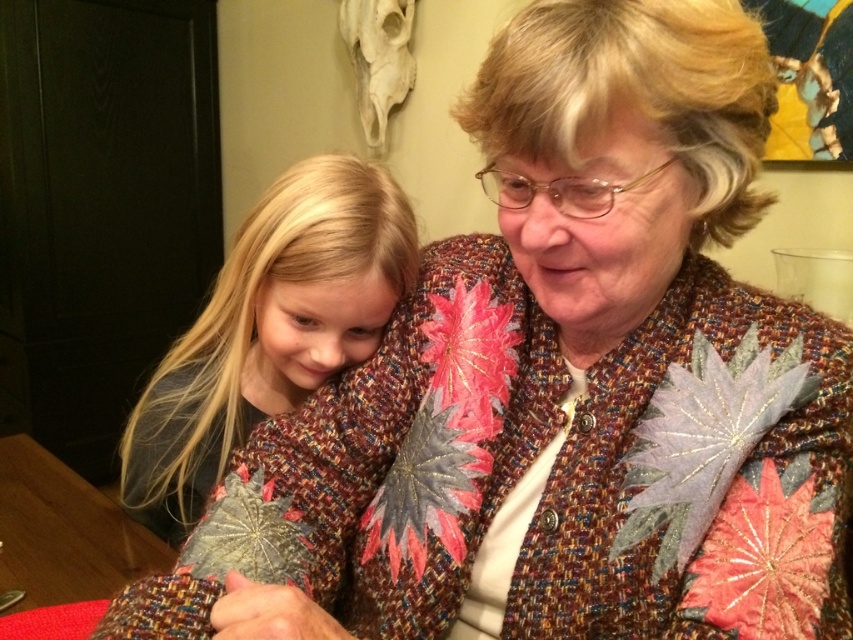
You are standing in the room and want to know which of the two points, point (398, 218) or point (55, 600), is closer to you. Can you determine this based on the scene?

Point (398, 218) is closer to the camera than point (55, 600), so it is closer to you.

You are a photographer trying to capture a candid shot of the grandmother and granddaughter. You notice the blonde hair at left and the wooden table at lower left. Which object is taller from your perspective?

The blonde hair at left is taller than the wooden table at lower left.